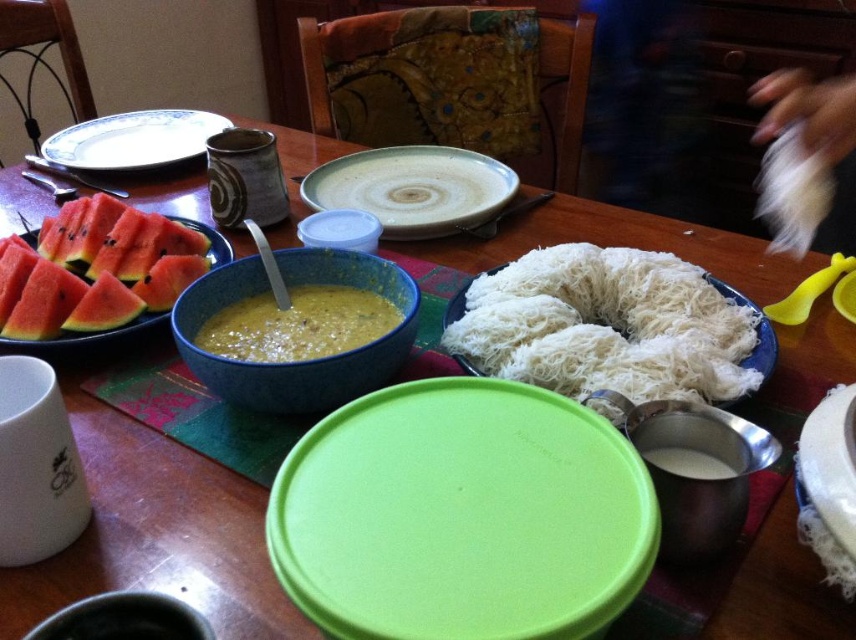
You are a guest at a dinner party and want to reach for the speckled ceramic plate at center and the white ceramic plate at upper left. Which plate should you reach for first if you want to grab the one closer to your right hand?

The speckled ceramic plate at center is positioned on the right side of white ceramic plate at upper left, so you should reach for the speckled ceramic plate at center first as it is closer to your right hand.

What is the exact coordinate of the red matte watermelon slices at left on the table?

The red matte watermelon slices at left are located at point (84,337).